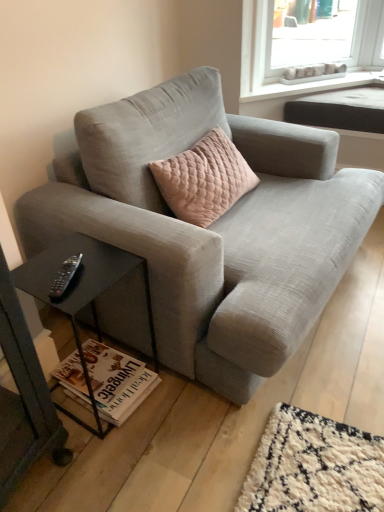
At what (x,y) coordinates should I click in order to perform the action: click on vacant area that is in front of white paper magazine at lower left. Please return your answer as a coordinate pair (x, y). Looking at the image, I should click on (99, 448).